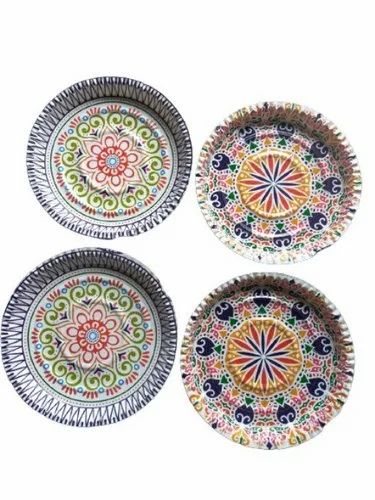
The image size is (375, 500). Identify the location of plates. (63, 354), (262, 340), (269, 182), (117, 153).